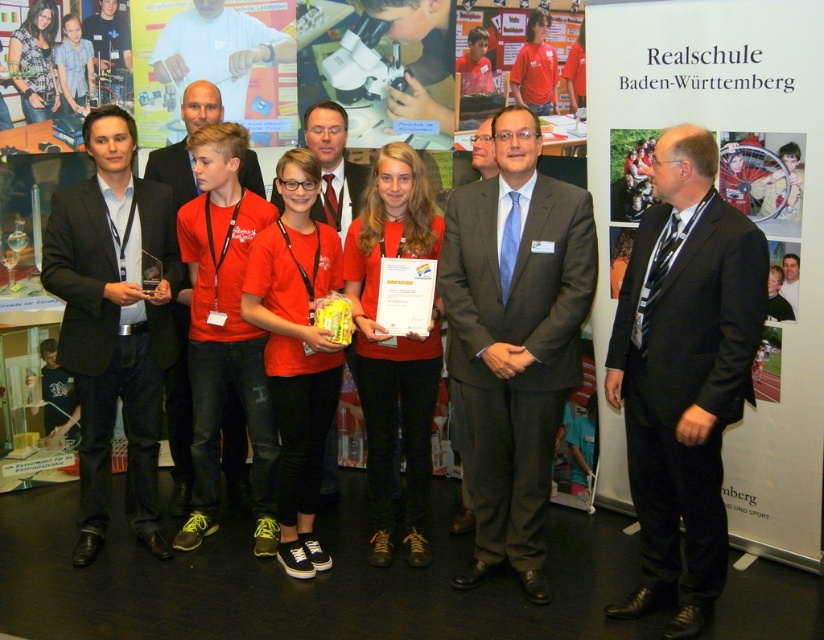
You are a photographer standing at the back of the room. You need to capture a photo that includes both the dark gray suit at center and the matte black suit at left. The camera you are using has a maximum focus range of 1.5 meters. Will you be able to fit both subjects into the frame without moving closer?

The distance between the dark gray suit at center and the matte black suit at left is 1.34 meters, which is within the camera maximum focus range of 1.5 meters. Therefore, you can capture both subjects in the frame without moving closer.

You are a photographer at the event and need to capture a photo of the black suit at center and the smooth white shirt at upper center. Which one is positioned lower in the image?

The black suit at center is located below the smooth white shirt at upper center, so the black suit at center is positioned lower in the image.

Consider the image. You are organizing a photo shoot and need to arrange the black suit at center and the matte black suit at left based on their sizes. Which suit should be placed first if you want the larger one to be more prominent?

The black suit at center is larger in size than the matte black suit at left, so you should place the black suit at center first to make it more prominent.